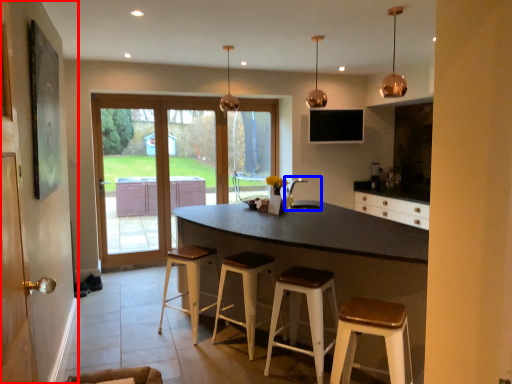
Question: Which point is closer to the camera, side (highlighted by a red box) or sink (highlighted by a blue box)?

Choices:
 (A) side
 (B) sink

Answer: (A)